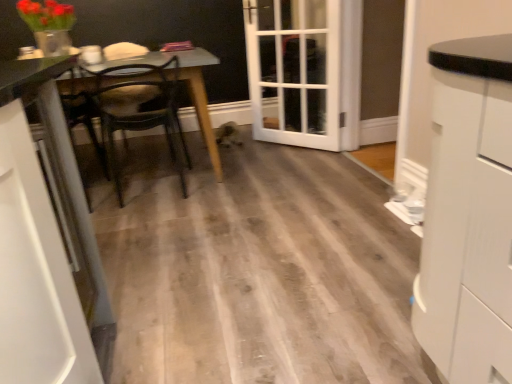
Locate an element on the screen. The height and width of the screenshot is (384, 512). free region under white glossy cabinet at left, arranged as the 1th cabinetry when viewed from the left (from a real-world perspective) is located at coordinates (105, 348).